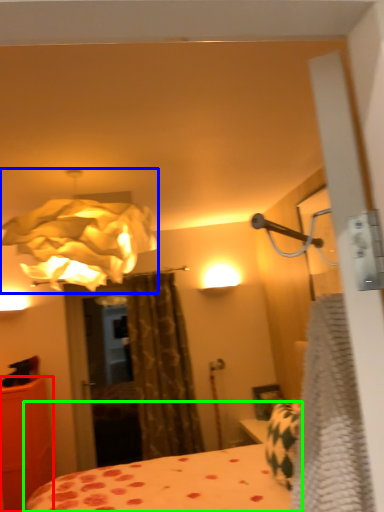
Question: Based on their relative distances, which object is farther from furniture (highlighted by a red box)? Choose from lamp (highlighted by a blue box) and bed (highlighted by a green box).

Choices:
 (A) lamp
 (B) bed

Answer: (A)